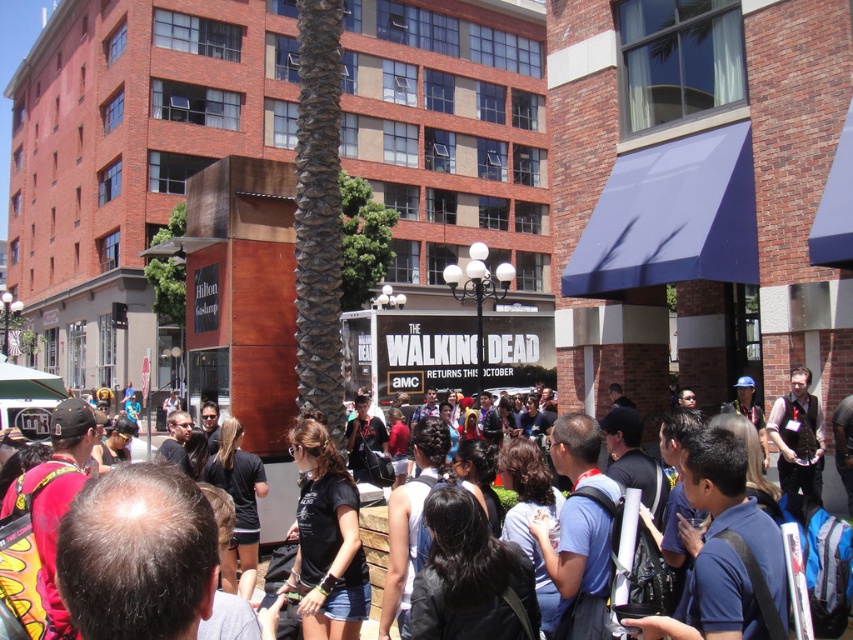
Can you confirm if black matte t-shirt at center is thinner than black t-shirt at center?

Correct, black matte t-shirt at center's width is less than black t-shirt at center's.

In the scene shown: Who is more distant from viewer, [314,458] or [20,376]?

The point [20,376] is behind.

Is point (366, 580) behind point (7, 371)?

No, it is in front of (7, 371).

You are a GUI agent. You are given a task and a screenshot of the screen. Output one action in this format:
    pyautogui.click(x=<x>, y=<y>)
    Task: Click on the black matte t-shirt at center
    The height and width of the screenshot is (640, 853).
    Given the screenshot: What is the action you would take?
    pyautogui.click(x=326, y=540)